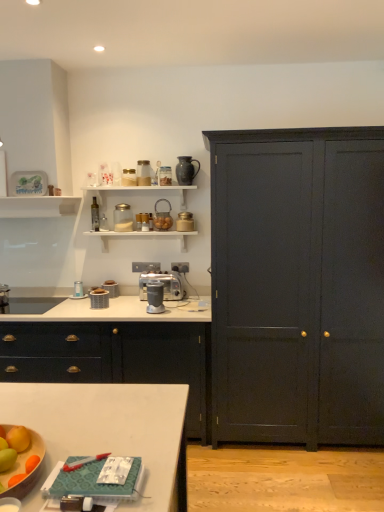
Find the location of a particular element. The image size is (384, 512). metallic silver toaster at upper center, the eighth appliance in the bottom-to-top sequence is located at coordinates [x=162, y=217].

Describe the element at coordinates (298, 285) in the screenshot. I see `matte black cupboard at right` at that location.

Measure the distance between point (120, 209) and camera.

Point (120, 209) is 11.26 feet from camera.

In order to face matte black cabinet at center, should I rotate leftwards or rightwards?

Rotate left and turn 13.496 degrees.

This screenshot has height=512, width=384. What do you see at coordinates (111, 288) in the screenshot? I see `metallic silver toaster at center, acting as the 9th appliance starting from the top` at bounding box center [111, 288].

In order to face metallic silver toaster at center, the 11th appliance from the top, should I rotate leftwards or rightwards?

To align with it, rotate left about 12.423°.

Identify the location of metallic silver toaster at upper center, which is the 4th appliance from top to bottom. The image size is (384, 512). (162, 217).

From the image's perspective, between metallic silver blender at center, which is the 4th appliance in bottom-to-top order, and translucent glass jar at upper center, which is the 1th appliance in top-to-bottom order, which one is located above?

translucent glass jar at upper center, which is the 1th appliance in top-to-bottom order, appears higher in the image.

Based on the photo, considering the positions of objects metallic silver blender at center, which is the 4th appliance in bottom-to-top order, and translucent glass jar at upper center, which is the 11th appliance in bottom-to-top order, in the image provided, who is behind, metallic silver blender at center, which is the 4th appliance in bottom-to-top order, or translucent glass jar at upper center, which is the 11th appliance in bottom-to-top order,?

translucent glass jar at upper center, which is the 11th appliance in bottom-to-top order.

Considering the sizes of objects metallic silver blender at center, which is the 4th appliance in bottom-to-top order, and translucent glass jar at upper center, which is the 11th appliance in bottom-to-top order, in the image provided, who is bigger, metallic silver blender at center, which is the 4th appliance in bottom-to-top order, or translucent glass jar at upper center, which is the 11th appliance in bottom-to-top order,?

With larger size is metallic silver blender at center, which is the 4th appliance in bottom-to-top order.

How many degrees apart are the facing directions of metallic silver blender at center, the eighth appliance viewed from the top, and translucent glass jar at upper center, which is the 11th appliance in bottom-to-top order?

1.15 degrees.

From the image's perspective, is metallic silver toaster at center, arranged as the third appliance when ordered from the bottom, located above clear glass jar at upper center, arranged as the 2th appliance when viewed from the top?

Incorrect, from the image's perspective, metallic silver toaster at center, arranged as the third appliance when ordered from the bottom, is lower than clear glass jar at upper center, arranged as the 2th appliance when viewed from the top.

Who is more distant, metallic silver toaster at center, acting as the 9th appliance starting from the top, or clear glass jar at upper center, arranged as the 2th appliance when viewed from the top?

metallic silver toaster at center, acting as the 9th appliance starting from the top.

Where is `the 2nd appliance counting from the left of the clear glass jar at upper center, arranged as the 2th appliance when viewed from the top`? the 2nd appliance counting from the left of the clear glass jar at upper center, arranged as the 2th appliance when viewed from the top is located at coordinates (111, 288).

Is point (104, 282) more distant than point (126, 182)?

Yes, point (104, 282) is farther from viewer.

Is matte black cabinet at center oriented away from metallic gold canister at upper center, the fifth appliance positioned from the bottom?

No, metallic gold canister at upper center, the fifth appliance positioned from the bottom, is not at the back of matte black cabinet at center.

Locate an element on the screen. The height and width of the screenshot is (512, 384). the 6th appliance behind the matte black cabinet at center is located at coordinates (185, 222).

Considering the sizes of matte black cabinet at center and metallic gold canister at upper center, the fifth appliance positioned from the bottom, in the image, is matte black cabinet at center bigger or smaller than metallic gold canister at upper center, the fifth appliance positioned from the bottom,?

Considering their sizes, matte black cabinet at center takes up more space than metallic gold canister at upper center, the fifth appliance positioned from the bottom.

Considering the relative positions of matte black cabinet at center and metallic gold canister at upper center, arranged as the 7th appliance when viewed from the top, in the image provided, is matte black cabinet at center to the left or to the right of metallic gold canister at upper center, arranged as the 7th appliance when viewed from the top,?

matte black cabinet at center is positioned on metallic gold canister at upper center, arranged as the 7th appliance when viewed from the top,'s left side.

Is point (138, 222) closer to viewer compared to point (162, 217)?

Yes, point (138, 222) is in front of point (162, 217).

Find the location of a particular element. This screenshot has height=512, width=384. the 3rd appliance positioned below the metallic silver toaster at upper center, the eighth appliance in the bottom-to-top sequence (from a real-world perspective) is located at coordinates (144, 222).

Looking at this image, from the image's perspective, which object appears higher, metallic silver toaster at upper center, arranged as the 6th appliance when ordered from the bottom, or metallic silver toaster at upper center, the eighth appliance in the bottom-to-top sequence?

From the image's view, metallic silver toaster at upper center, the eighth appliance in the bottom-to-top sequence, is above.

Is metallic glass bottle at upper center, the 9th appliance positioned from the bottom, inside the boundaries of metallic silver toaster at center, acting as the 9th appliance starting from the top, or outside?

The correct answer is: outside.

Which object is wider, metallic glass bottle at upper center, the 9th appliance positioned from the bottom, or metallic silver toaster at center, arranged as the third appliance when ordered from the bottom?

metallic silver toaster at center, arranged as the third appliance when ordered from the bottom, is wider.

The height and width of the screenshot is (512, 384). I want to click on the 8th appliance directly above the metallic silver toaster at center, acting as the 9th appliance starting from the top (from a real-world perspective), so [x=95, y=215].

Is metallic glass bottle at upper center, marked as the 3th appliance in a top-to-bottom arrangement, to the left of metallic silver toaster at center, acting as the 9th appliance starting from the top, from the viewer's perspective?

Yes, metallic glass bottle at upper center, marked as the 3th appliance in a top-to-bottom arrangement, is to the left of metallic silver toaster at center, acting as the 9th appliance starting from the top.

Looking at this image, is transparent glass jar at upper center, which is the seventh appliance in bottom-to-top order, at the back of metallic silver toaster at center, the 11th appliance from the top?

That's not correct — metallic silver toaster at center, the 11th appliance from the top, is not looking away from transparent glass jar at upper center, which is the seventh appliance in bottom-to-top order.

Is metallic silver toaster at center, acting as the 1th appliance starting from the bottom, positioned far away from transparent glass jar at upper center, which is counted as the fifth appliance, starting from the top?

No.

Which object is closer to the camera, metallic silver toaster at center, the 11th appliance from the top, or transparent glass jar at upper center, which is the seventh appliance in bottom-to-top order?

Positioned in front is metallic silver toaster at center, the 11th appliance from the top.

From the image's perspective, between metallic silver toaster at center, the 11th appliance from the top, and transparent glass jar at upper center, which is counted as the fifth appliance, starting from the top, who is located below?

metallic silver toaster at center, the 11th appliance from the top, from the image's perspective.

Can you confirm if translucent glass jar at upper center, which is the 1th appliance in top-to-bottom order, is shorter than matte black cupboard at right?

Yes.

Is translucent glass jar at upper center, which is the 11th appliance in bottom-to-top order, next to matte black cupboard at right?

No.

Locate an element on the screen. the 7th appliance directly beneath the translucent glass jar at upper center, which is the 11th appliance in bottom-to-top order (from a real-world perspective) is located at coordinates (163, 285).

From the image's perspective, count 7th appliances upward from the metallic silver toaster at center, acting as the 9th appliance starting from the top, and point to it. Please provide its 2D coordinates.

[(129, 177)]

Looking at the image, which one is located closer to metallic silver toaster at upper center, the eighth appliance in the bottom-to-top sequence, white glossy sink at lower left or metallic silver toaster at upper center, the 6th appliance from the top?

Based on the image, metallic silver toaster at upper center, the 6th appliance from the top, appears to be nearer to metallic silver toaster at upper center, the eighth appliance in the bottom-to-top sequence.

Based on their spatial positions, is matte black cupboard at right or translucent glass jar at upper center, which is the 11th appliance in bottom-to-top order, further from metallic silver blender at center, the eighth appliance viewed from the top?

matte black cupboard at right is positioned further to the anchor metallic silver blender at center, the eighth appliance viewed from the top.

From the image, which object appears to be nearer to translucent glass jar at upper center, which is the 1th appliance in top-to-bottom order, metallic silver toaster at center, acting as the 9th appliance starting from the top, or matte black cupboard at right?

metallic silver toaster at center, acting as the 9th appliance starting from the top.

Looking at the image, which one is located closer to metallic silver toaster at upper center, which is the 4th appliance from top to bottom, transparent glass jar at upper center, which is counted as the fifth appliance, starting from the top, or matte gray blender at center, the tenth appliance from the top?

The object closer to metallic silver toaster at upper center, which is the 4th appliance from top to bottom, is transparent glass jar at upper center, which is counted as the fifth appliance, starting from the top.

Based on their spatial positions, is metallic silver toaster at center, acting as the 1th appliance starting from the bottom, or metallic silver toaster at upper center, the 6th appliance from the top, closer to transparent glass jar at upper center, which is the seventh appliance in bottom-to-top order?

Among the two, metallic silver toaster at upper center, the 6th appliance from the top, is located nearer to transparent glass jar at upper center, which is the seventh appliance in bottom-to-top order.

Which object lies further to the anchor point metallic glass bottle at upper center, the 9th appliance positioned from the bottom, metallic silver toaster at center, acting as the 9th appliance starting from the top, or transparent glass jar at upper center, which is the seventh appliance in bottom-to-top order?

metallic silver toaster at center, acting as the 9th appliance starting from the top, is further to metallic glass bottle at upper center, the 9th appliance positioned from the bottom.

Which object lies further to the anchor point metallic silver toaster at center, arranged as the third appliance when ordered from the bottom, transparent glass jar at upper center, which is the seventh appliance in bottom-to-top order, or translucent glass jar at upper center, which is the 11th appliance in bottom-to-top order?

translucent glass jar at upper center, which is the 11th appliance in bottom-to-top order, is further to metallic silver toaster at center, arranged as the third appliance when ordered from the bottom.

Which object lies further to the anchor point translucent glass jar at upper center, which is the 1th appliance in top-to-bottom order, white glossy sink at lower left or metallic silver toaster at center, acting as the 1th appliance starting from the bottom?

Based on the image, white glossy sink at lower left appears to be further to translucent glass jar at upper center, which is the 1th appliance in top-to-bottom order.

This screenshot has width=384, height=512. What are the coordinates of `sink between translucent glass jar at upper center, which is the 1th appliance in top-to-bottom order, and matte black cabinet at center, in the vertical direction` in the screenshot? It's located at (35, 298).

Where is `cabinetry situated between white glossy sink at lower left and metallic silver toaster at center, acting as the 9th appliance starting from the top, from left to right`? The height and width of the screenshot is (512, 384). cabinetry situated between white glossy sink at lower left and metallic silver toaster at center, acting as the 9th appliance starting from the top, from left to right is located at coordinates (112, 358).

Find the location of a particular element. The height and width of the screenshot is (512, 384). sink between metallic silver toaster at upper center, which is the 4th appliance from top to bottom, and matte black cabinet at center, in the vertical direction is located at coordinates [x=35, y=298].

Find the location of a particular element. The height and width of the screenshot is (512, 384). cabinetry located between white glossy sink at lower left and metallic silver toaster at center, acting as the 1th appliance starting from the bottom, in the left-right direction is located at coordinates (112, 358).